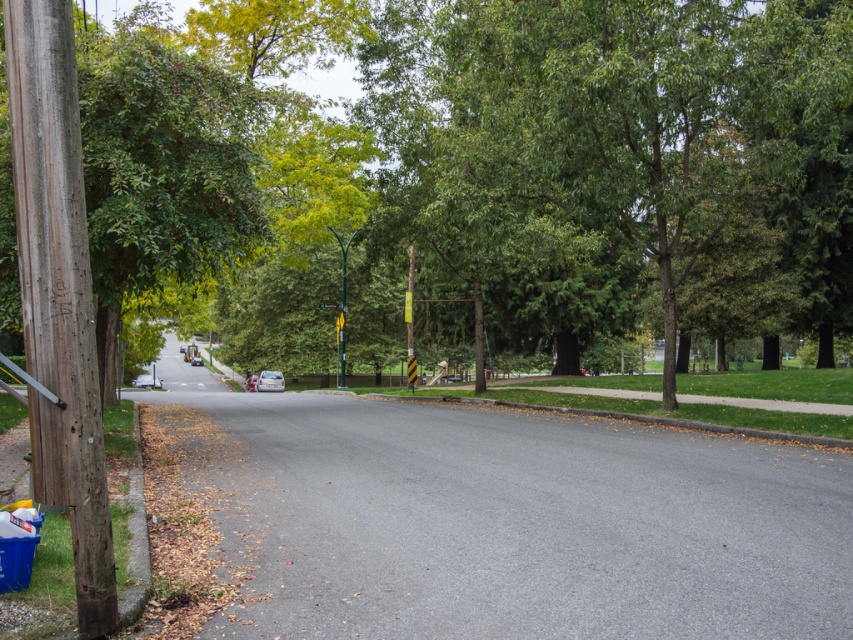
Can you confirm if green leafy tree at center is shorter than weathered wood pole at left?

In fact, green leafy tree at center may be taller than weathered wood pole at left.

Is green leafy tree at center below weathered wood pole at left?

No.

Which is behind, point (628, 54) or point (65, 333)?

The point (628, 54) is behind.

Identify the location of green leafy tree at center. (621, 160).

Does weathered wood pole at left appear over metallic pole at center?

No.

Can you confirm if weathered wood pole at left is positioned to the right of metallic pole at center?

No, weathered wood pole at left is not to the right of metallic pole at center.

Identify the location of weathered wood pole at left. (57, 292).

Where is `weathered wood pole at left`? The height and width of the screenshot is (640, 853). weathered wood pole at left is located at coordinates (57, 292).

Does weathered wood pole at left appear on the right side of green plastic street sign at center?

Correct, you'll find weathered wood pole at left to the right of green plastic street sign at center.

Who is lower down, weathered wood pole at left or green plastic street sign at center?

weathered wood pole at left is lower down.

Who is more forward, (x=99, y=588) or (x=338, y=307)?

Positioned in front is point (x=99, y=588).

Find the location of `weathered wood pole at left`. weathered wood pole at left is located at coordinates (57, 292).